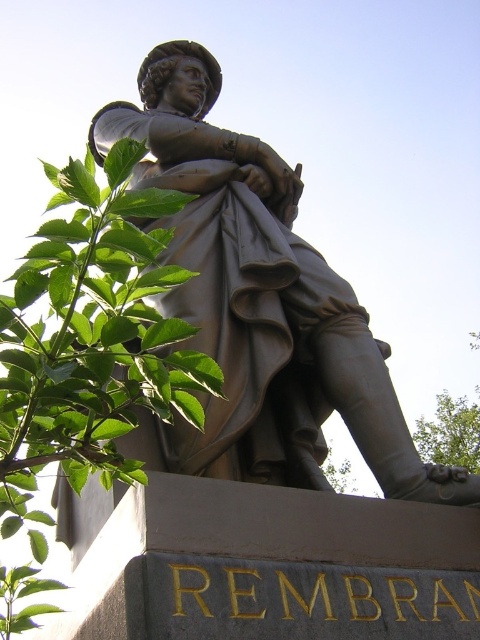
You are a landscape architect designing a garden around the Rembrandt statue. You need to place a new pathway between the two green leafy plants. Given that the pathway must be at least 70 meters long to accommodate visitors, will the distance between the green leafy plant at upper left and the green leafy plant at lower right suffice?

The green leafy plant at upper left and the green leafy plant at lower right are 77.73 meters apart, which exceeds the required 70 meters. Therefore, the distance between them is sufficient to accommodate the pathway.

You are standing in front of the statue of Rembrandt van Rijn. If you were to place a small plaque at the exact center of the image, would the bronze statue at center be to the left or right of the plaque?

The bronze statue at center is located at point 0.463 on the x and 0.540 on the y. Since the exact center of the image would be at coordinates 0.5, the bronze statue at center is slightly to the left of the plaque.

You are standing in front of the statue of Rembrandt van Rijn and want to take a photo that includes both the bronze statue at center and the green leafy plant at upper left. Which object should you ensure is closer to the camera to include both in focus?

The bronze statue at center is further to the viewer than the green leafy plant at upper left, so you should ensure the bronze statue at center is closer to the camera to include both in focus.